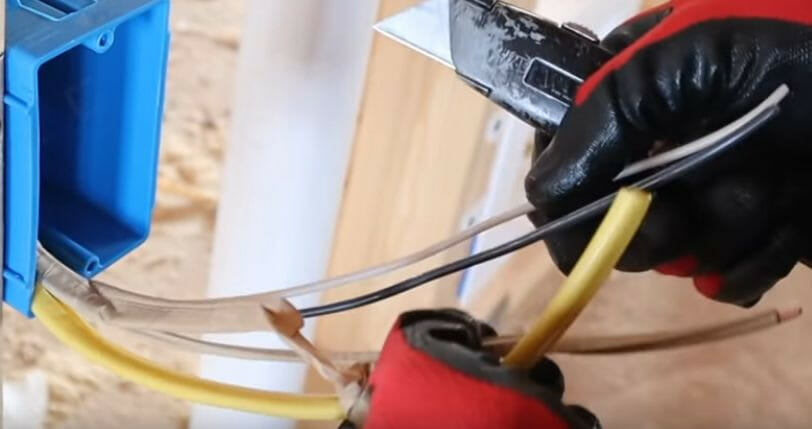
What are the coordinates of `white trim` in the screenshot? It's located at (286, 145).